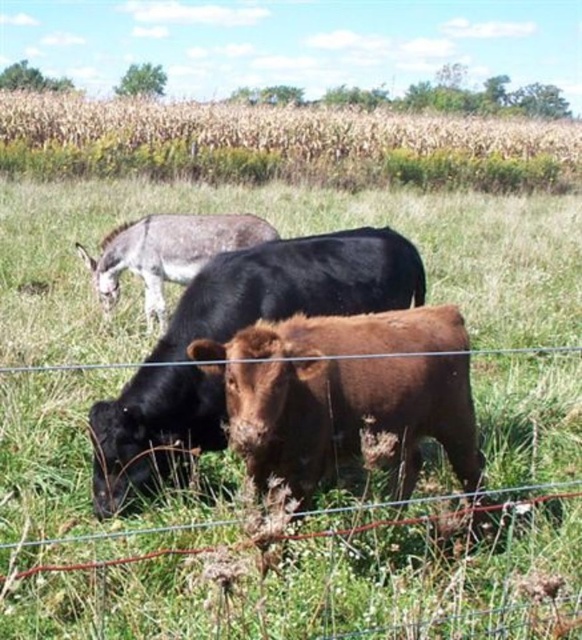
Is wire mesh at lower center in front of brown matte cow at center?

Yes, wire mesh at lower center is in front of brown matte cow at center.

Looking at this image, can you confirm if wire mesh at lower center is taller than brown matte cow at center?

No.

Identify the location of wire mesh at lower center. The height and width of the screenshot is (640, 582). (303, 554).

Who is taller, golden wheat field at upper center or brown furry bull at center?

golden wheat field at upper center

Is golden wheat field at upper center smaller than brown furry bull at center?

Actually, golden wheat field at upper center might be larger than brown furry bull at center.

Find the location of a particular element. golden wheat field at upper center is located at coordinates (260, 140).

The width and height of the screenshot is (582, 640). Find the location of `golden wheat field at upper center`. golden wheat field at upper center is located at coordinates (260, 140).

Consider the image. Does wire mesh at lower center appear under golden wheat field at upper center?

Yes.

Image resolution: width=582 pixels, height=640 pixels. What do you see at coordinates (303, 554) in the screenshot?
I see `wire mesh at lower center` at bounding box center [303, 554].

The image size is (582, 640). I want to click on wire mesh at lower center, so click(x=303, y=554).